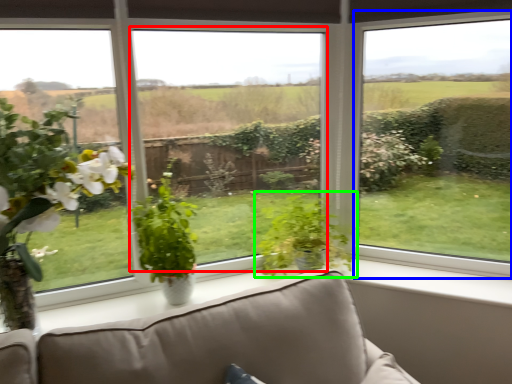
Question: Considering the real-world distances, which object is closest to window screen (highlighted by a red box)? window (highlighted by a blue box) or houseplant (highlighted by a green box).

Choices:
 (A) window
 (B) houseplant

Answer: (B)